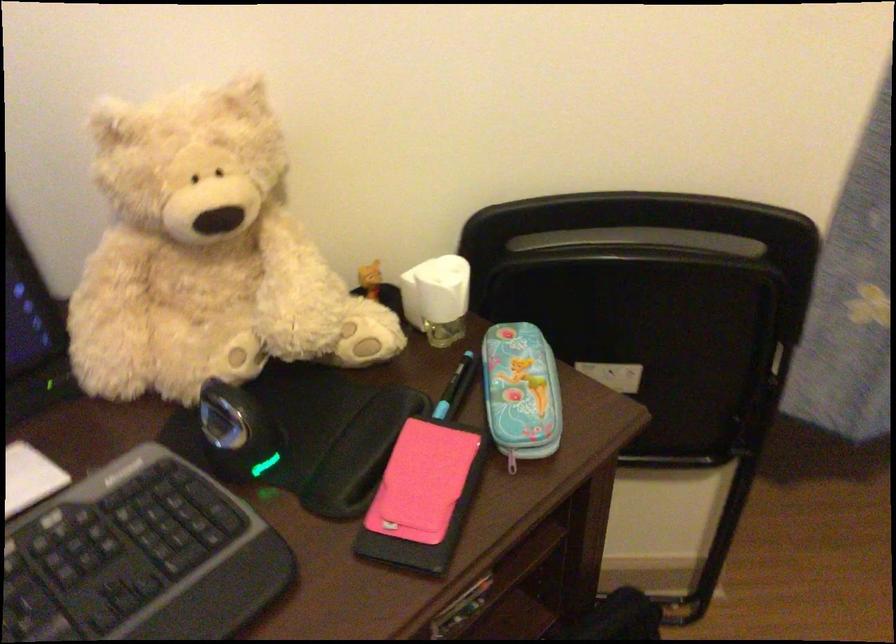
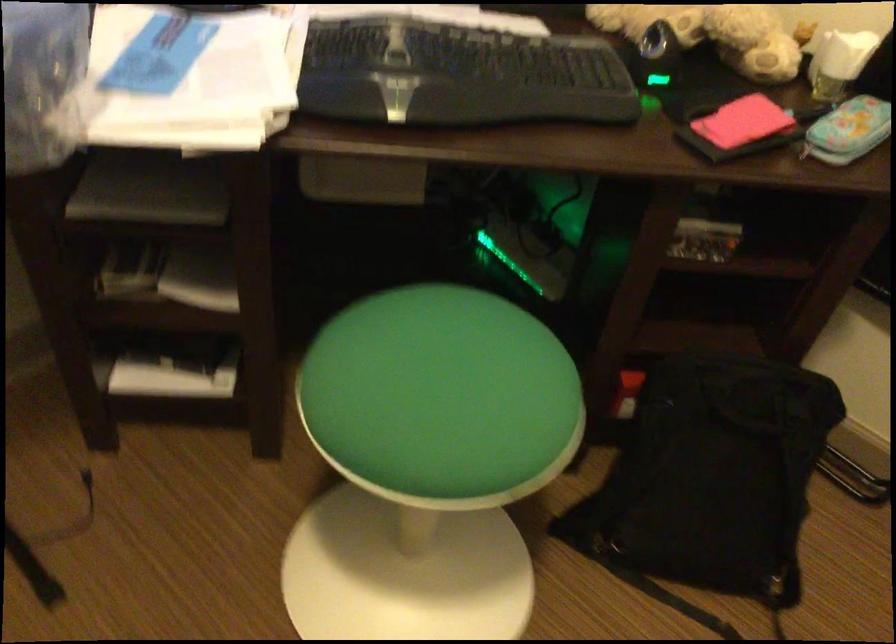
The point at [543,410] is marked in the first image. Where is the corresponding point in the second image?

(848, 129)